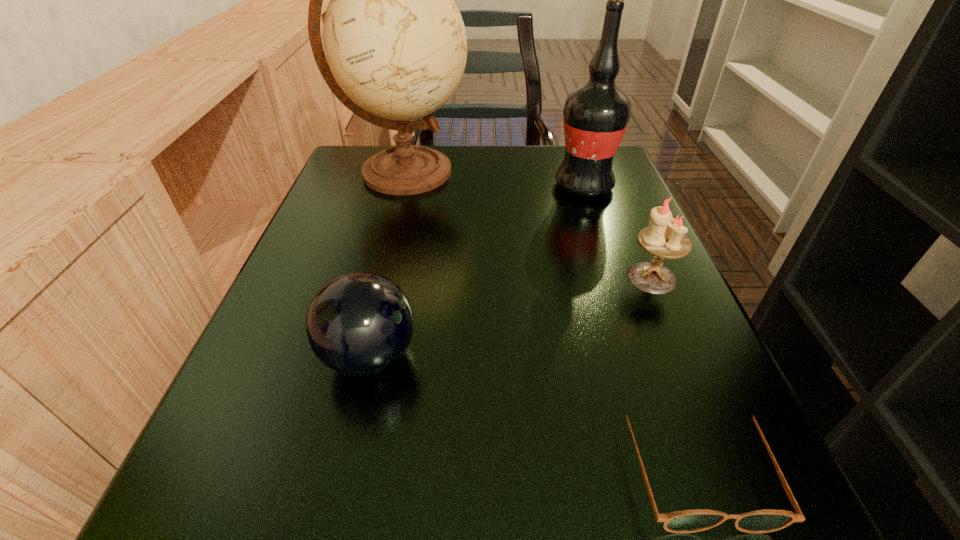
Locate an element on the screen. This screenshot has width=960, height=540. object that stands as the second closest to the sunglasses is located at coordinates (359, 324).

Locate an element on the screen. Image resolution: width=960 pixels, height=540 pixels. free point that satisfies the following two spatial constraints: 1. on the front side of the third farthest object; 2. on the side of the bowling ball with the finger holes is located at coordinates (685, 356).

You are a GUI agent. You are given a task and a screenshot of the screen. Output one action in this format:
    pyautogui.click(x=<x>, y=<y>)
    Task: Click on the free space that satisfies the following two spatial constraints: 1. on the front side of the wine bottle; 2. on the side of the second nearest object with the finger holes
    The height and width of the screenshot is (540, 960).
    Given the screenshot: What is the action you would take?
    pyautogui.click(x=641, y=356)

Image resolution: width=960 pixels, height=540 pixels. Find the location of `free spot that satisfies the following two spatial constraints: 1. on the surface of the globe; 2. on the right side of the second tallest object`. free spot that satisfies the following two spatial constraints: 1. on the surface of the globe; 2. on the right side of the second tallest object is located at coordinates (401, 186).